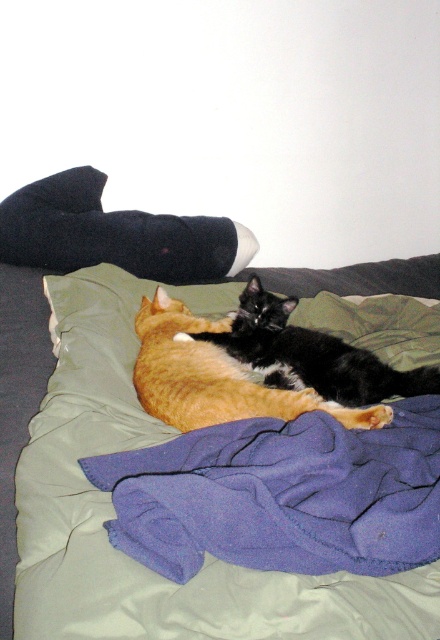
Is point (128, 632) less distant than point (310, 346)?

That is True.

Between soft green blanket at center and black fur cat at center, which one is positioned higher?

black fur cat at center

The width and height of the screenshot is (440, 640). I want to click on soft green blanket at center, so click(x=113, y=513).

Is purple fleece blanket at center below black fur cat at center?

Yes.

Who is shorter, purple fleece blanket at center or black fur cat at center?

purple fleece blanket at center

Is point (429, 493) behind point (279, 348)?

No, it is not.

You are a GUI agent. You are given a task and a screenshot of the screen. Output one action in this format:
    pyautogui.click(x=<x>, y=<y>)
    Task: Click on the purple fleece blanket at center
    
    Given the screenshot: What is the action you would take?
    pyautogui.click(x=281, y=496)

Between point (162, 428) and point (301, 497), which one is positioned in front?

Point (301, 497)

Between soft green blanket at center and purple fleece blanket at center, which one has less height?

purple fleece blanket at center

What do you see at coordinates (113, 513) in the screenshot?
I see `soft green blanket at center` at bounding box center [113, 513].

The image size is (440, 640). I want to click on soft green blanket at center, so click(x=113, y=513).